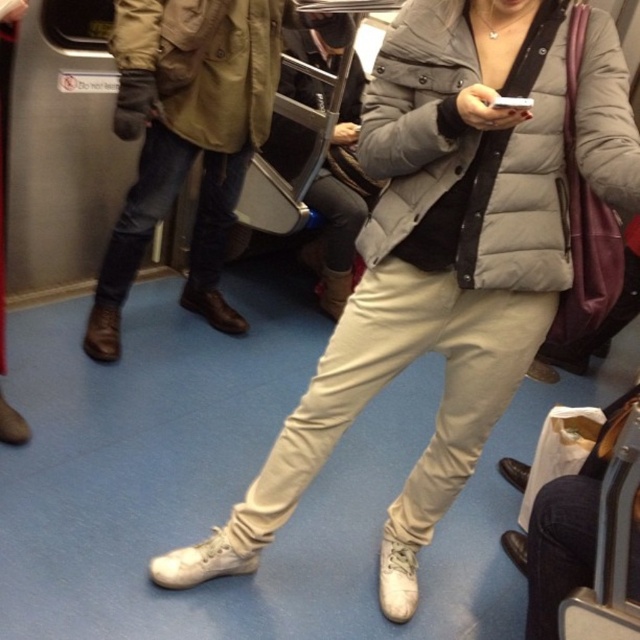
You are a delivery robot with a 2.5 feet wide package. You need to move between the white leather sneakers at lower center and the leather boots at lower left. Can you fit through the space between them?

The distance between the white leather sneakers at lower center and the leather boots at lower left is 3.42 feet. Since the package is 2.5 feet wide, the robot can fit through the space between them as the distance is wider than the package.

You are standing in the subway car and want to take a photo of the two points mentioned. Which point, point [520,20] or point [176,164], will appear larger in your photo?

Point [520,20] will appear larger in the photo because it is closer to the camera than point [176,164].

You are a passenger in the subway car and need to step over a small obstacle. You have to choose between moving towards the white leather sneakers at lower center or the leather boots at lower left. Which direction should you choose to ensure your foot has more space?

The white leather sneakers at lower center is bigger than the leather boots at lower left, so choosing to move towards the white leather sneakers at lower center would provide more space for your foot.